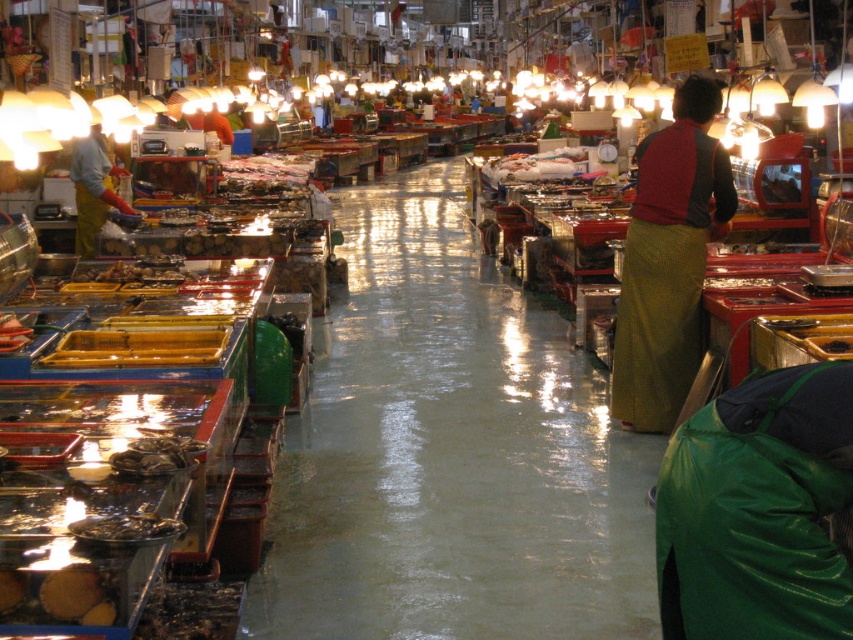
Question: Which object is closer to the camera taking this photo?

Choices:
 (A) yellow rubber gloves at left
 (B) green woven skirt at right
 (C) shiny metallic fish at center

Answer: (C)

Question: Which point is farther to the camera?

Choices:
 (A) (88, 202)
 (B) (67, 618)
 (C) (140, 525)
 (D) (193, 460)

Answer: (A)

Question: Does yellow rubber gloves at left appear over shiny metallic fish at center?

Choices:
 (A) yes
 (B) no

Answer: (A)

Question: Which object is the farthest from the green woven skirt at right?

Choices:
 (A) smooth brown bread at lower left
 (B) shiny metallic fish at center
 (C) yellow rubber gloves at left

Answer: (C)

Question: Considering the relative positions of yellow rubber gloves at left and shiny metallic fish at center in the image provided, where is yellow rubber gloves at left located with respect to shiny metallic fish at center?

Choices:
 (A) right
 (B) left

Answer: (B)

Question: Can you confirm if green woven skirt at right is smaller than smooth brown bread at lower left?

Choices:
 (A) yes
 (B) no

Answer: (B)